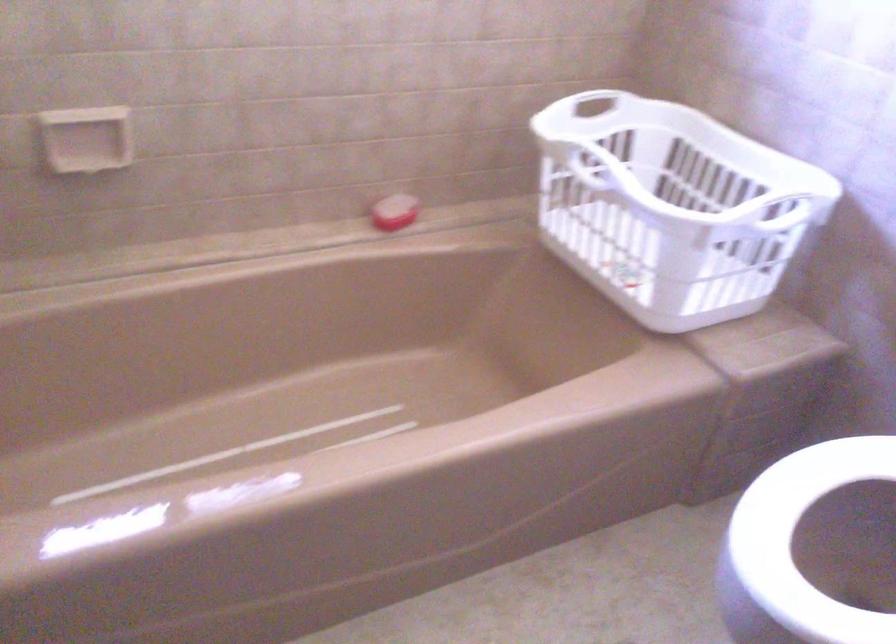
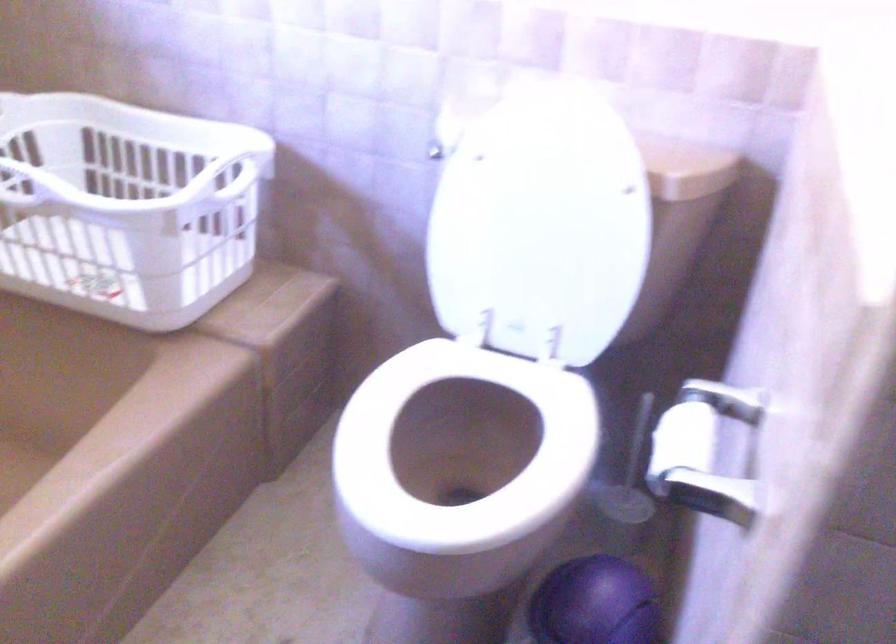
Locate, in the second image, the point that corresponds to pixel 647 135 in the first image.

(55, 138)